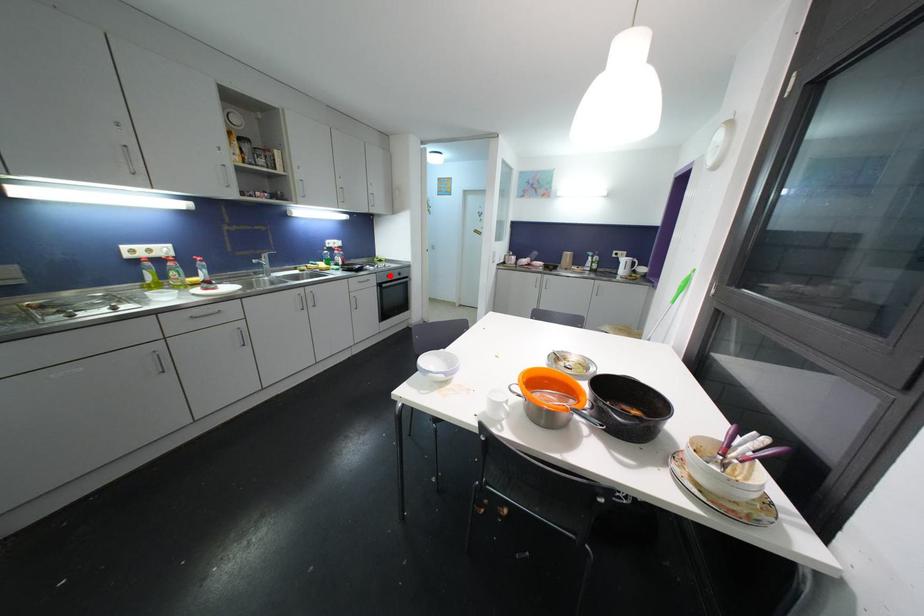
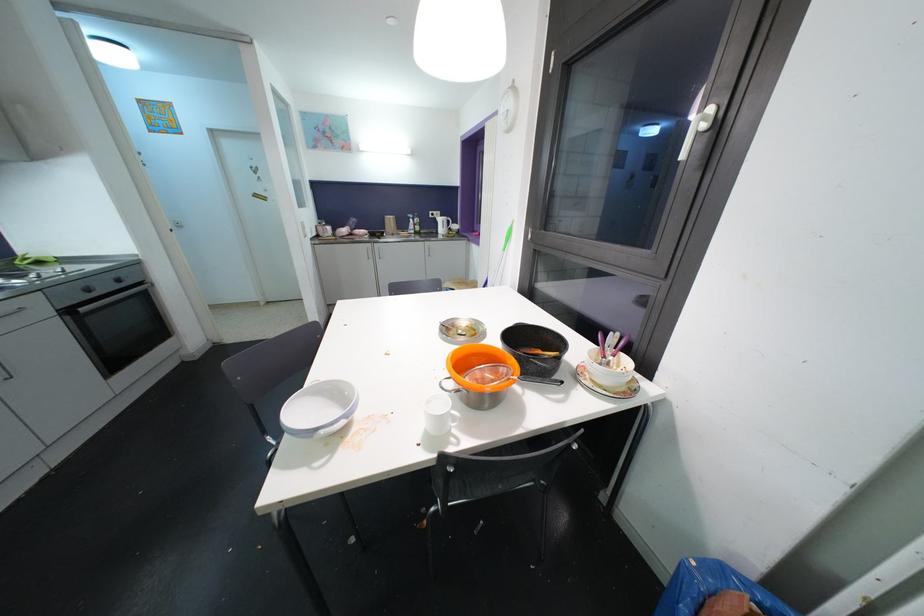
Question: I am providing you with two images of the same scene from different viewpoints. A red point is shown in image1. For the corresponding object point in image2, is it positioned nearer or farther from the camera?

Choices:
 (A) Nearer
 (B) Farther

Answer: (B)